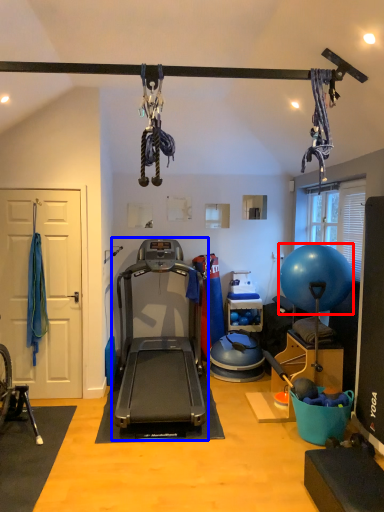
Question: Which point is closer to the camera, ball (highlighted by a red box) or treadmill (highlighted by a blue box)?

Choices:
 (A) ball
 (B) treadmill

Answer: (B)